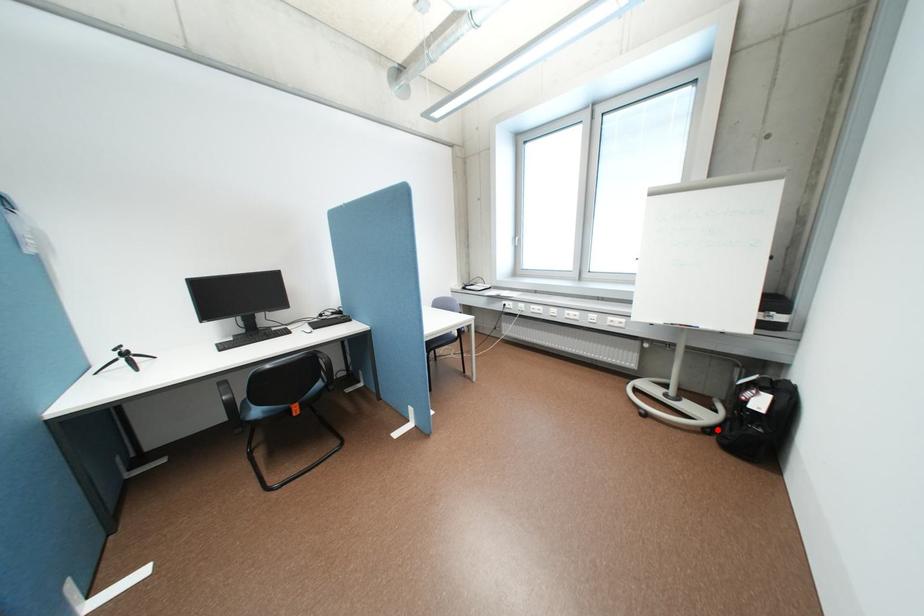
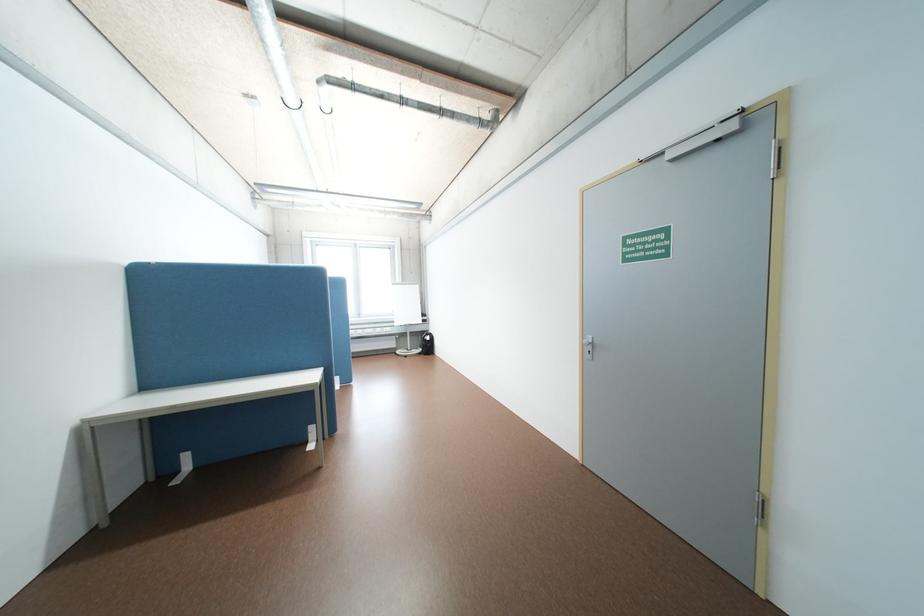
Question: I am providing you with two images of the same scene from different viewpoints. A red point is shown in image1. For the corresponding object point in image2, is it positioned nearer or farther from the camera?

Choices:
 (A) Nearer
 (B) Farther

Answer: (B)